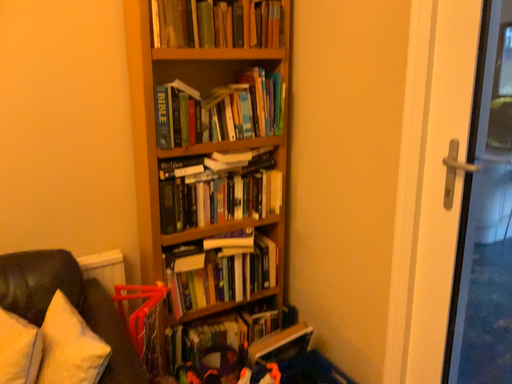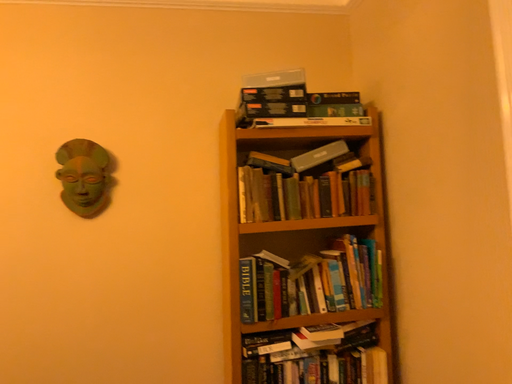
Question: How did the camera likely rotate when shooting the video?

Choices:
 (A) rotated downward
 (B) rotated upward

Answer: (B)